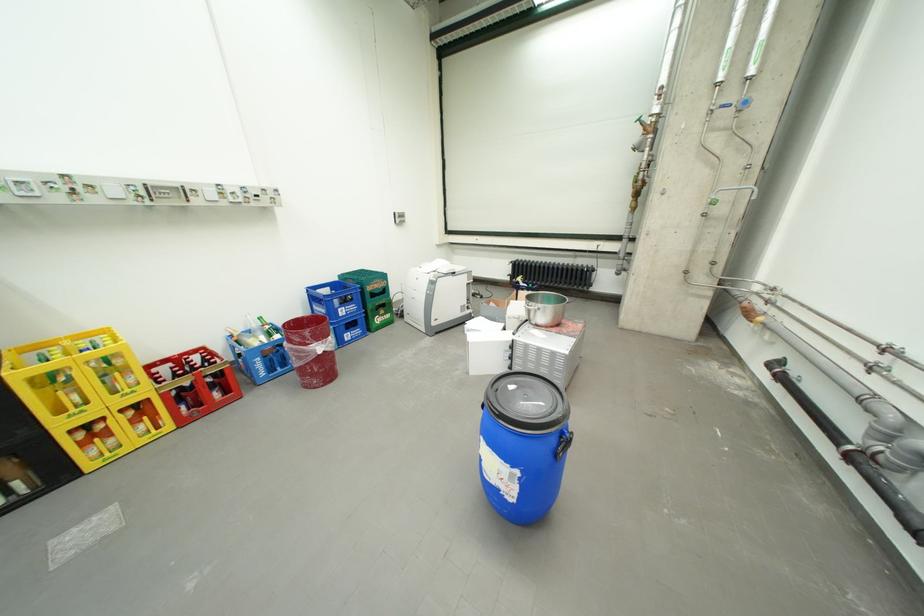
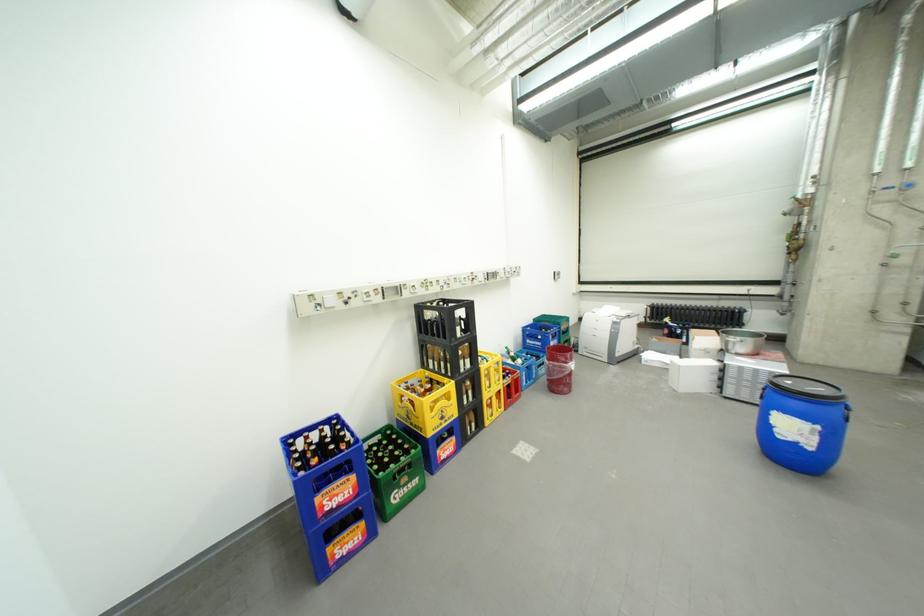
Find the pixel in the second image that matches the point at 468,371 in the first image.

(674, 390)